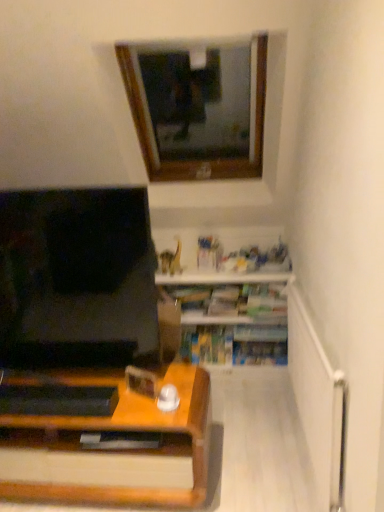
Where is `free spot above white glossy shelf at lower center (from a real-world perspective)`? free spot above white glossy shelf at lower center (from a real-world perspective) is located at coordinates (222, 267).